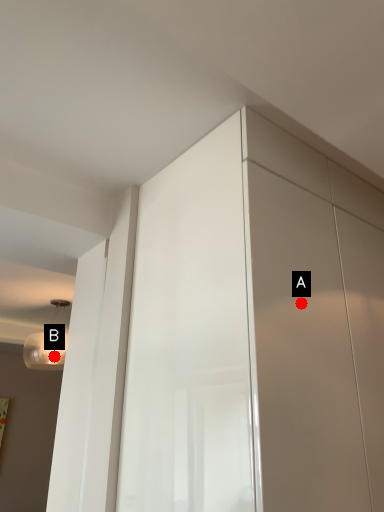
Question: Two points are circled on the image, labeled by A and B beside each circle. Which point is closer to the camera?

Choices:
 (A) A is closer
 (B) B is closer

Answer: (A)